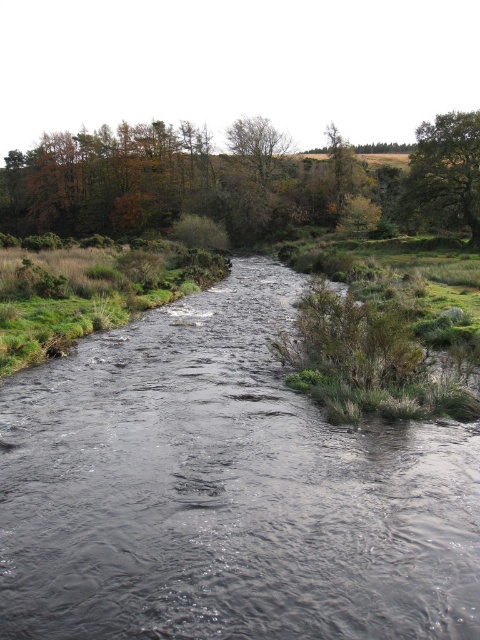
You are standing at the center of the river and want to reach the green leafy tree at upper right. Which direction should you move to get there?

The green leafy tree at upper right is located at point 0.273 on the x axis and 0.929 on the y axis, so you should move towards the upper right direction to reach it.

From the picture: You are standing at the origin point of the image. Where is the black water at center located in terms of coordinates?

The black water at center is located at coordinates point (225, 490).